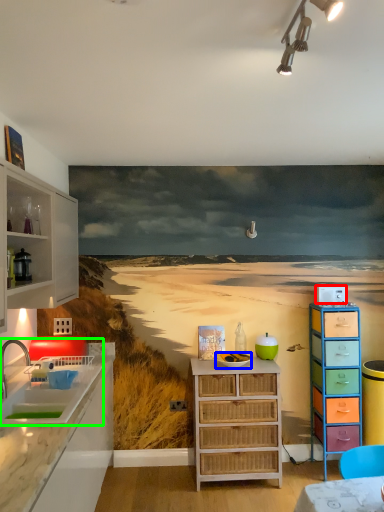
Question: Estimate the real-world distances between objects in this image. Which object is closer to appliance (highlighted by a red box), appliance (highlighted by a blue box) or sink (highlighted by a green box)?

Choices:
 (A) appliance
 (B) sink

Answer: (A)